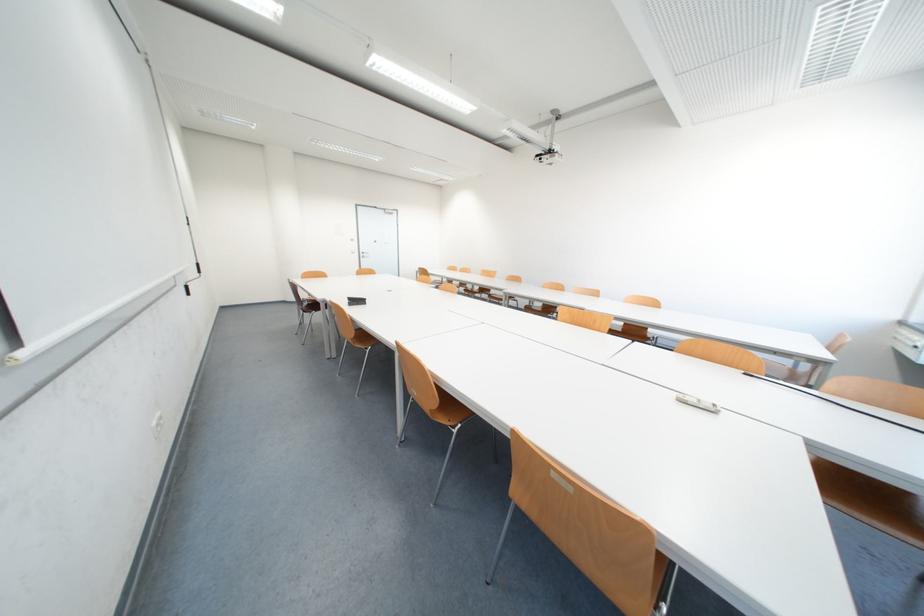
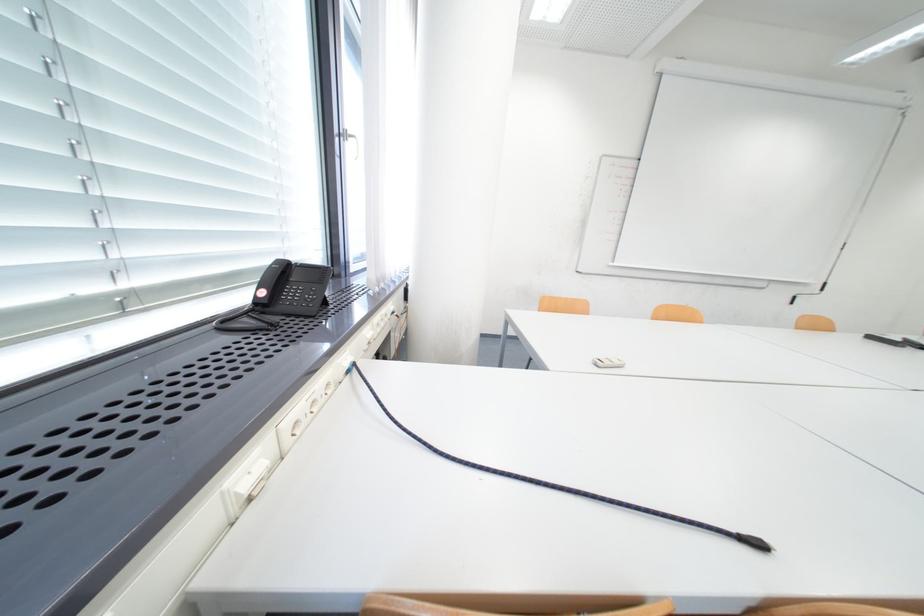
Question: I am providing you with two images of the same scene from different viewpoints. Please identify which objects are invisible in image2.

Choices:
 (A) brown chair sitting surface
 (B) braided cable plug
 (C) white power outlet
 (D) white cleaning bottle

Answer: (A)